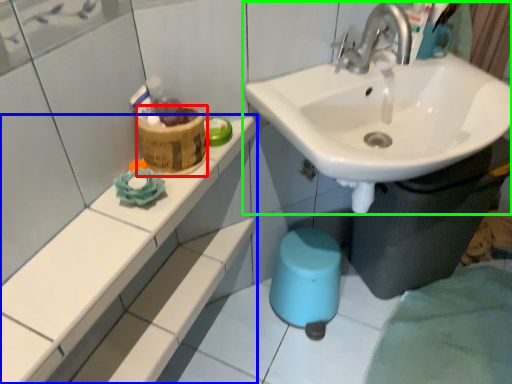
Question: Which is farther away from potty (highlighted by a red box)? counter top (highlighted by a blue box) or sink (highlighted by a green box)?

Choices:
 (A) counter top
 (B) sink

Answer: (B)